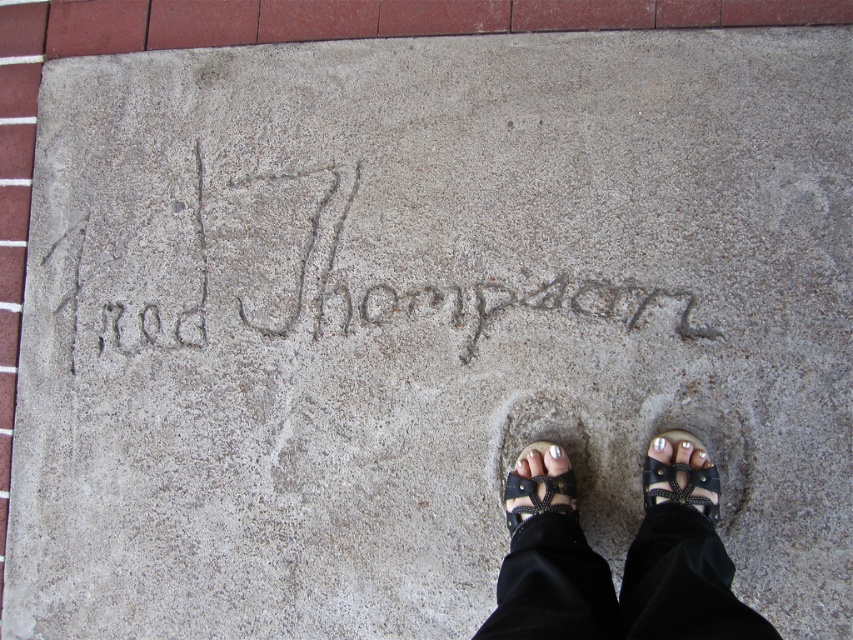
You are standing on the sidewalk and notice the black leather sandals at center and the gray concrete writing at center. Which object is positioned to the right of the other?

The black leather sandals at center is to the right of gray concrete writing at center.

You are standing on the sidewalk and see the gray concrete writing at center. Where are the black leather sandals at center in relation to the writing?

The black leather sandals at center are located below the gray concrete writing at center, so they are positioned underneath it.

You are standing on the sidewalk where the name Fred Thompson is etched. You notice two pairs of black leather sandals at center and black leather sandal at center. Which one is positioned to the right?

The black leather sandals at center is positioned to the right of the black leather sandal at center.